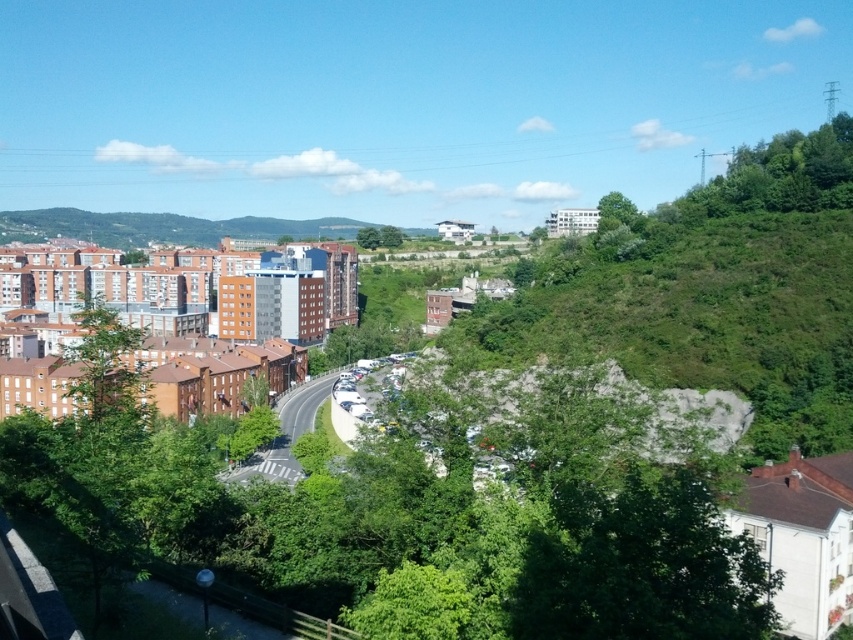
Question: Which of the following is the closest to the observer?

Choices:
 (A) orange brick buildings at left
 (B) green leafy tree at left
 (C) green leafy tree at upper right

Answer: (B)

Question: Which object appears closest to the camera in this image?

Choices:
 (A) green leafy tree at upper right
 (B) orange brick buildings at left
 (C) green leafy tree at left

Answer: (C)

Question: Is green leafy tree at left to the left of green leafy tree at upper right from the viewer's perspective?

Choices:
 (A) yes
 (B) no

Answer: (A)

Question: Does green leafy tree at left have a larger size compared to green leafy tree at upper right?

Choices:
 (A) no
 (B) yes

Answer: (B)

Question: Which object is positioned farthest from the green leafy tree at left?

Choices:
 (A) orange brick buildings at left
 (B) green leafy tree at upper right

Answer: (B)

Question: Does orange brick buildings at left come behind green leafy tree at left?

Choices:
 (A) yes
 (B) no

Answer: (A)